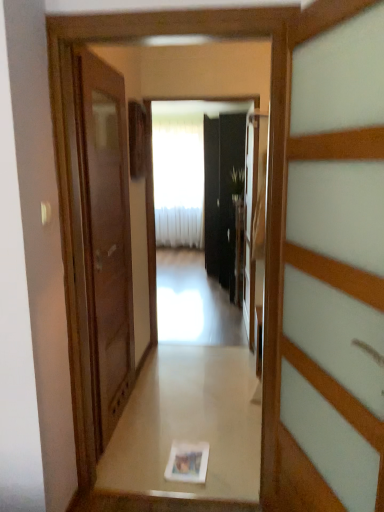
Locate an element on the screen. The width and height of the screenshot is (384, 512). blank space situated above white glossy photo frame at center (from a real-world perspective) is located at coordinates (187, 460).